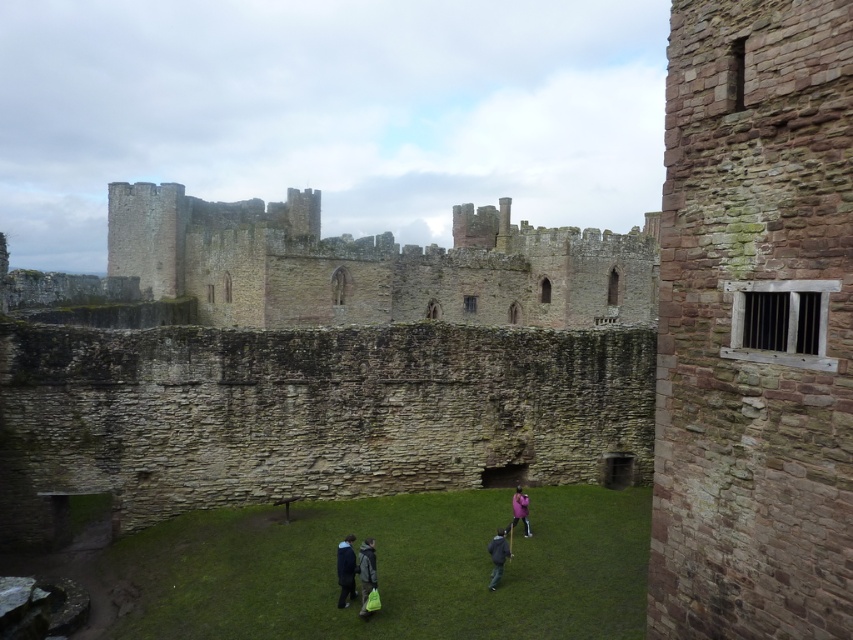
Question: Which of the following is the closest to the observer?

Choices:
 (A) (364, 561)
 (B) (337, 547)
 (C) (506, 556)

Answer: (A)

Question: Which point appears closest to the camera in this image?

Choices:
 (A) (523, 506)
 (B) (492, 538)
 (C) (368, 538)

Answer: (B)

Question: Does brown stone castle at center have a lesser width compared to dark gray jacket at center?

Choices:
 (A) yes
 (B) no

Answer: (B)

Question: Can you confirm if brown stone castle at center is positioned below dark blue fabric jacket at lower center?

Choices:
 (A) yes
 (B) no

Answer: (B)

Question: Can you confirm if green fabric bag at center is smaller than pink fabric at center?

Choices:
 (A) yes
 (B) no

Answer: (A)

Question: Among these objects, which one is farthest from the camera?

Choices:
 (A) green fabric bag at center
 (B) dark blue fabric jacket at lower center
 (C) dark gray jacket at center

Answer: (C)